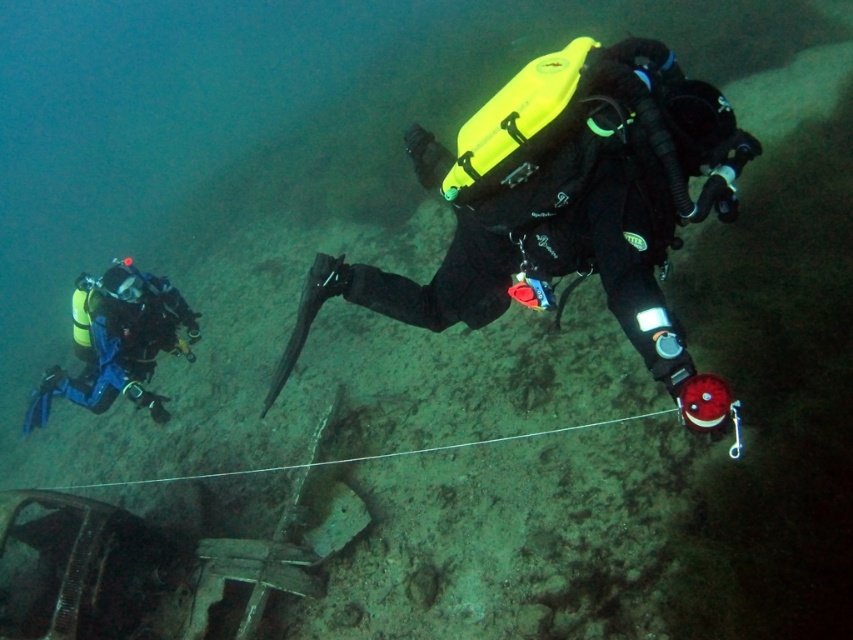
You are a marine biologist planning to dive near the wreck. You see the matte black diving suit at center and the blue matte scuba diver at left in the water. Which diver is wider in the image?

The matte black diving suit at center might be wider than blue matte scuba diver at left according to the description.

You are a scuba diver navigating an underwater wreck. You notice two points of interest marked as point 1 and point 2. Point 1 is at coordinates point (347, 296) and point 2 is at point (38, 404). Based on the scene, which point is closer to you?

Point 1 at coordinates point (347, 296) is closer to you because it is in front of point 2 at point (38, 404).

You are a scuba diver planning to swim from your current position to the point marked at coordinates point (714, 412). Given that your oxygen tank has enough air for a 100 foot swim, will you have enough oxygen to reach that point?

The distance between your current position and point (714, 412) is 6.61 feet, which is well within the 100 foot range of your oxygen supply. Yes, you will have enough oxygen to reach that point.